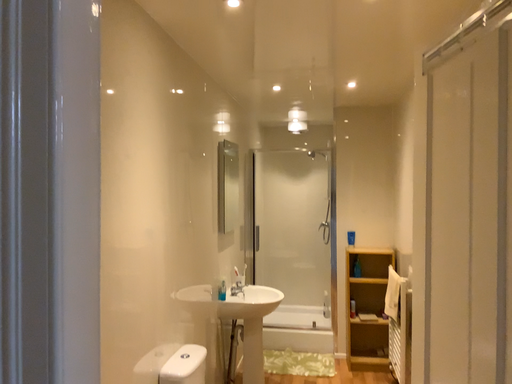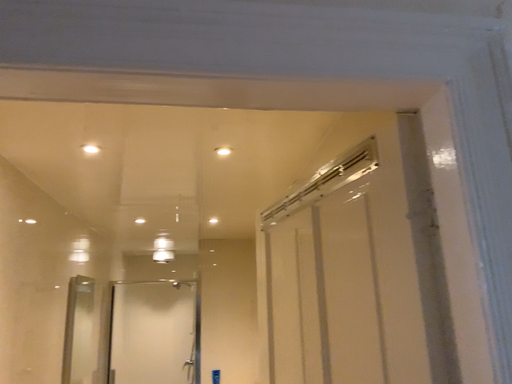
Question: How did the camera likely rotate when shooting the video?

Choices:
 (A) rotated downward
 (B) rotated upward

Answer: (B)